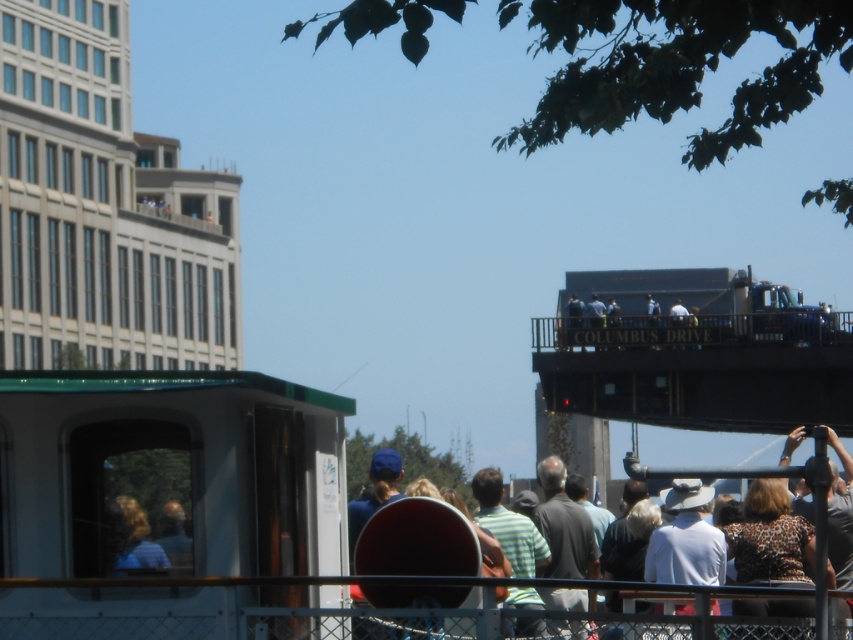
From the picture: Does green matte train car at left have a greater width compared to brown leopard print shirt at lower right?

No.

The height and width of the screenshot is (640, 853). I want to click on green matte train car at left, so click(164, 497).

Identify the location of green matte train car at left. (164, 497).

Is green matte train car at left positioned behind blonde hair at left?

No, it is not.

I want to click on green matte train car at left, so click(164, 497).

Is brown leopard print shirt at lower right to the left of blonde hair at left from the viewer's perspective?

In fact, brown leopard print shirt at lower right is to the right of blonde hair at left.

Locate an element on the screen. This screenshot has width=853, height=640. brown leopard print shirt at lower right is located at coordinates point(770,538).